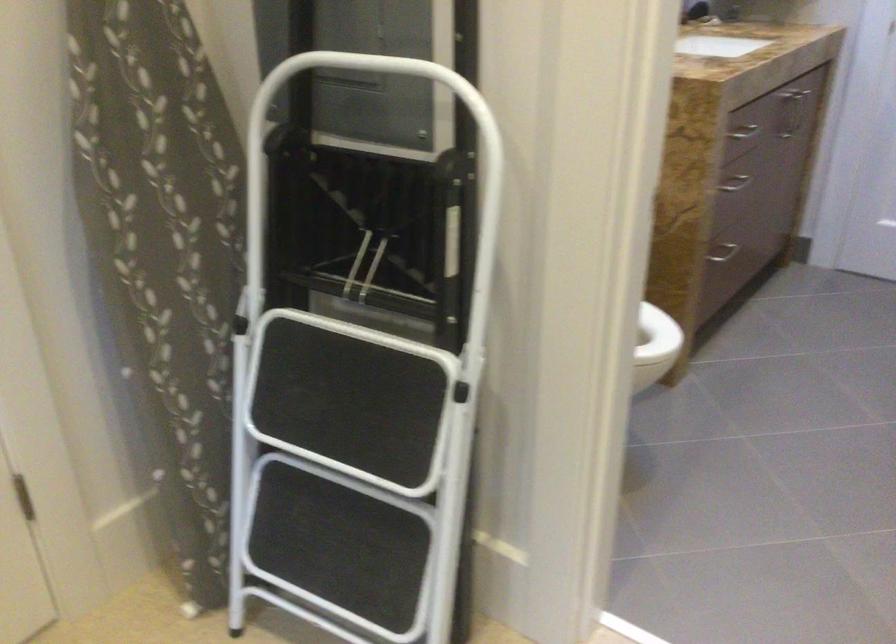
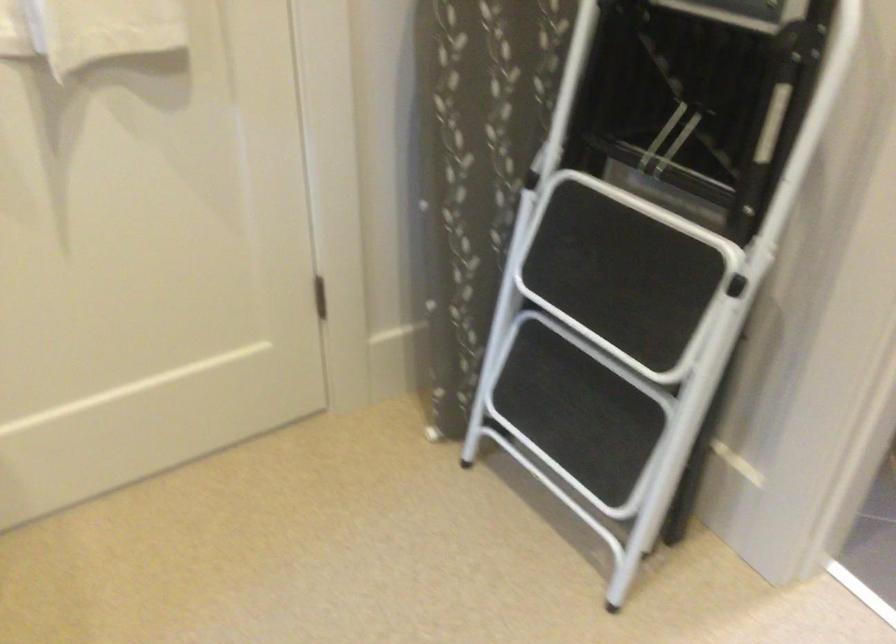
Locate, in the second image, the point that corresponds to point 373,343 in the first image.

(658, 216)